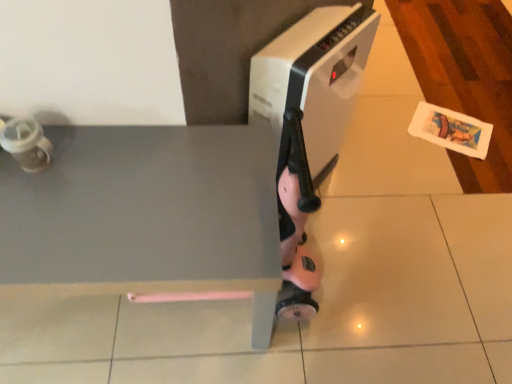
Question: Is matte gray tile at center wider or thinner than white plastic heater at center?

Choices:
 (A) wide
 (B) thin

Answer: (A)

Question: From the image's perspective, is matte gray tile at center above or below white plastic heater at center?

Choices:
 (A) above
 (B) below

Answer: (B)

Question: Estimate the real-world distances between objects in this image. Which object is closer to the matte gray tile at center?

Choices:
 (A) white plastic heater at center
 (B) matte gray table at lower left

Answer: (B)

Question: Which object is positioned closest to the white plastic heater at center?

Choices:
 (A) matte gray table at lower left
 (B) matte gray tile at center

Answer: (A)